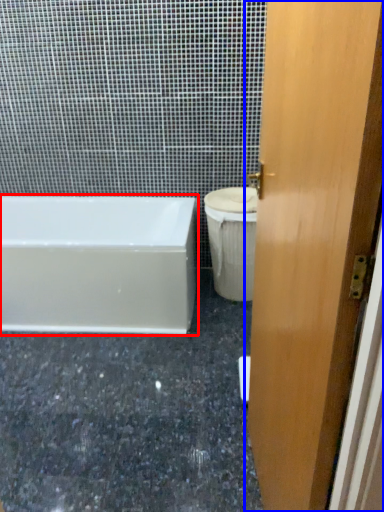
Question: Which object is further to the camera taking this photo, bathtub (highlighted by a red box) or door (highlighted by a blue box)?

Choices:
 (A) bathtub
 (B) door

Answer: (A)